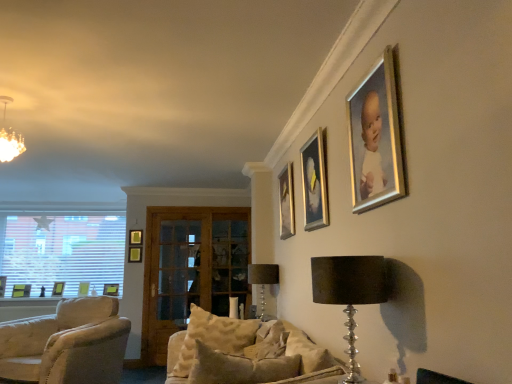
Question: Is white blinds at left oriented away from matte green picture frame at lower left, marked as the third picture frame in a back-to-front arrangement?

Choices:
 (A) yes
 (B) no

Answer: (A)

Question: Can we say white blinds at left lies outside matte green picture frame at lower left, marked as the third picture frame in a back-to-front arrangement?

Choices:
 (A) no
 (B) yes

Answer: (B)

Question: Is matte green picture frame at lower left, which ranks as the 5th picture frame in front-to-back order, surrounded by white blinds at left?

Choices:
 (A) yes
 (B) no

Answer: (B)

Question: Is white blinds at left facing towards matte green picture frame at lower left, the sixth picture frame from the right?

Choices:
 (A) yes
 (B) no

Answer: (A)

Question: Considering the relative sizes of white blinds at left and matte green picture frame at lower left, arranged as the 2th picture frame when viewed from the left, in the image provided, is white blinds at left wider than matte green picture frame at lower left, arranged as the 2th picture frame when viewed from the left,?

Choices:
 (A) yes
 (B) no

Answer: (B)

Question: Considering the positions of shiny silver table lamp at lower right, which is the 1th table lamp in front-to-back order, and satin black table lamp at center, the second table lamp in the front-to-back sequence, in the image, is shiny silver table lamp at lower right, which is the 1th table lamp in front-to-back order, taller or shorter than satin black table lamp at center, the second table lamp in the front-to-back sequence,?

Choices:
 (A) short
 (B) tall

Answer: (B)

Question: From the image's perspective, is shiny silver table lamp at lower right, acting as the 1th table lamp starting from the right, above or below satin black table lamp at center, placed as the second table lamp when sorted from right to left?

Choices:
 (A) above
 (B) below

Answer: (A)

Question: Relative to satin black table lamp at center, the second table lamp in the front-to-back sequence, is shiny silver table lamp at lower right, which is the 1th table lamp in front-to-back order, in front or behind?

Choices:
 (A) behind
 (B) front

Answer: (B)

Question: Visually, is shiny silver table lamp at lower right, the 2th table lamp from the back, positioned to the left or to the right of satin black table lamp at center, the second table lamp in the front-to-back sequence?

Choices:
 (A) right
 (B) left

Answer: (A)

Question: Choose the correct answer: Is matte black picture frame at lower left, the seventh picture frame positioned from the right, inside matte green picture frame at lower left, marked as the third picture frame in a back-to-front arrangement, or outside it?

Choices:
 (A) inside
 (B) outside

Answer: (B)

Question: Is point (19, 291) positioned closer to the camera than point (54, 284)?

Choices:
 (A) farther
 (B) closer

Answer: (B)

Question: From a real-world perspective, relative to matte green picture frame at lower left, which ranks as the 5th picture frame in front-to-back order, is matte black picture frame at lower left, arranged as the fourth picture frame when viewed from the back, vertically above or below?

Choices:
 (A) above
 (B) below

Answer: (B)

Question: Looking at their shapes, would you say matte black picture frame at lower left, the seventh picture frame positioned from the right, is wider or thinner than matte green picture frame at lower left, arranged as the 2th picture frame when viewed from the left?

Choices:
 (A) wide
 (B) thin

Answer: (A)

Question: From the image's perspective, is clear glass door at center, which is the first glass door from left to right, located above or below matte black picture frame at lower left, arranged as the fourth picture frame when viewed from the back?

Choices:
 (A) below
 (B) above

Answer: (B)

Question: Looking at their shapes, would you say clear glass door at center, which is the first glass door from left to right, is wider or thinner than matte black picture frame at lower left, positioned as the 4th picture frame in front-to-back order?

Choices:
 (A) wide
 (B) thin

Answer: (A)